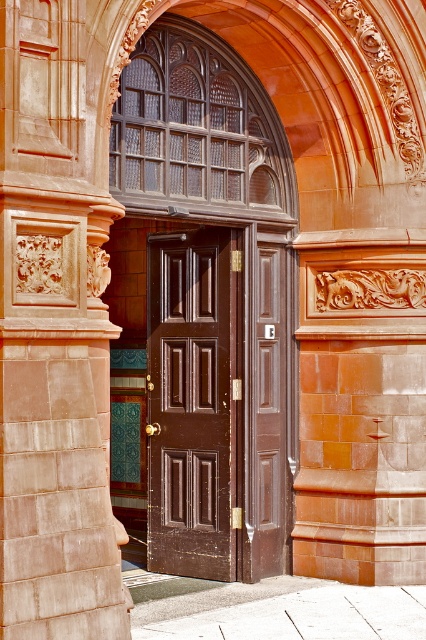
Can you confirm if matte brown door at center is smaller than shiny dark wood door at center?

No, matte brown door at center is not smaller than shiny dark wood door at center.

The image size is (426, 640). What do you see at coordinates (207, 394) in the screenshot? I see `matte brown door at center` at bounding box center [207, 394].

You are a GUI agent. You are given a task and a screenshot of the screen. Output one action in this format:
    pyautogui.click(x=<x>, y=<y>)
    Task: Click on the matte brown door at center
    The width and height of the screenshot is (426, 640).
    Given the screenshot: What is the action you would take?
    pyautogui.click(x=207, y=394)